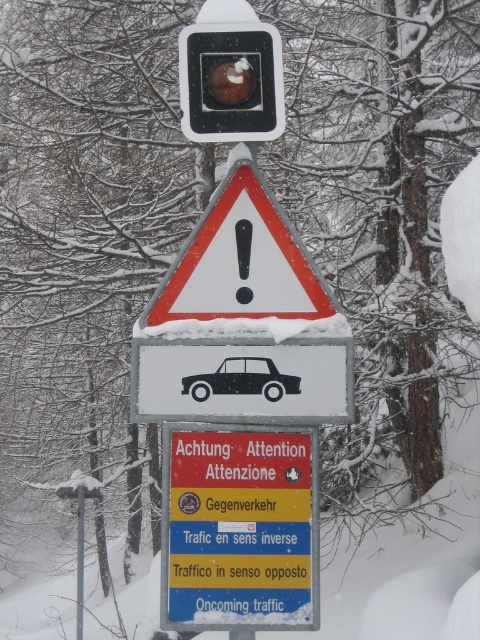
You are standing at the point indicated by the coordinates point (240, 528). Looking around, you see a red plastic sign at center. What direction should you face to see the red plastic sign at center?

The point (240, 528) indicates the red plastic sign at center, so you are already facing the red plastic sign at center.

You are a driver approaching the traffic signpost in the snowy area. You need to know which object on the signpost is wider. Which one is wider between the white triangular warning sign at center and the black matte car at center?

The white triangular warning sign at center is wider than the black matte car at center according to the description.

You are a pedestrian standing in front of the traffic signpost in the snowy area. You need to read both the red plastic sign at center and the white triangular warning sign at center. Which one should you look at first if you want to read the one on the left?

The red plastic sign at center is to the left of the white triangular warning sign at center, so you should look at the red plastic sign at center first.